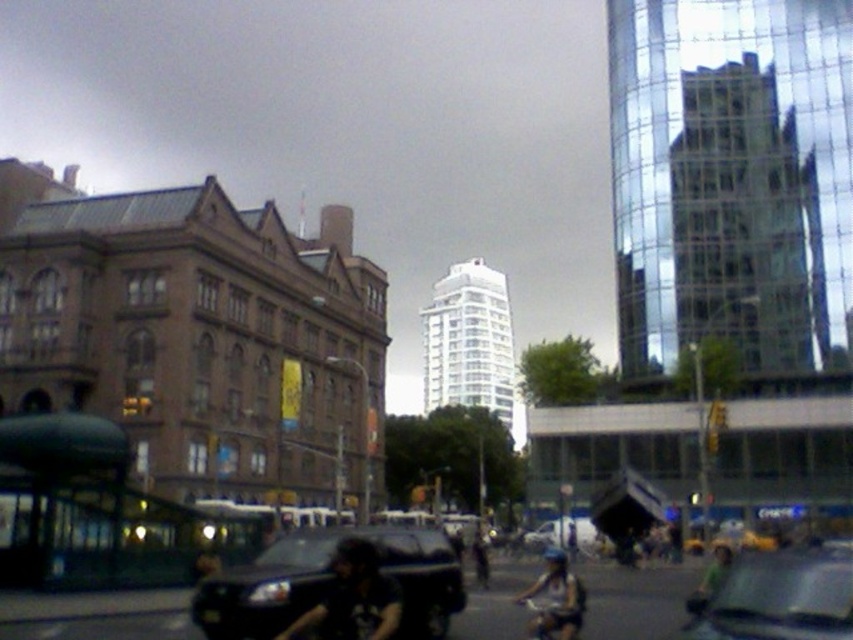
You are a delivery person who needs to pick up a package from the dark blue helmet at center and place it on the green fabric bicycle at center. Considering their heights, will you need to bend down to place the package?

The dark blue helmet at center is taller than the green fabric bicycle at center, so you will need to bend down to place the package from the helmet onto the bicycle.

You are a pedestrian standing at the intersection and want to cross the street. You see a shiny black car at lower left and a dark blue shirt at center. Which object is closer to you?

The shiny black car at lower left is closer to the viewer than the dark blue shirt at center.

In the scene shown: You are a delivery person needing to park your vehicle in the parking lot behind the shiny black car at lower left and the metallic silver car at center. Based on their sizes, which car will require a larger parking space?

The metallic silver car at center requires a larger parking space because the shiny black car at lower left occupies less space than it.